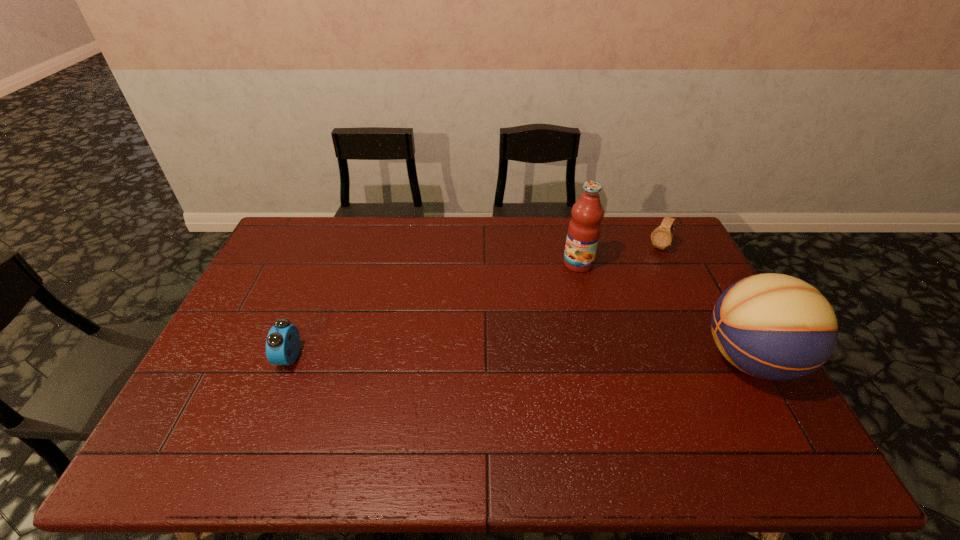
The height and width of the screenshot is (540, 960). Find the location of `free space on the desktop that is between the leftmost object and the basketball and is positioned on the front label of the third object from right to left`. free space on the desktop that is between the leftmost object and the basketball and is positioned on the front label of the third object from right to left is located at coordinates (475, 358).

The width and height of the screenshot is (960, 540). Find the location of `free space on the desktop that is between the leftmost object and the basketball and is positioned on the face of the watch`. free space on the desktop that is between the leftmost object and the basketball and is positioned on the face of the watch is located at coordinates (579, 359).